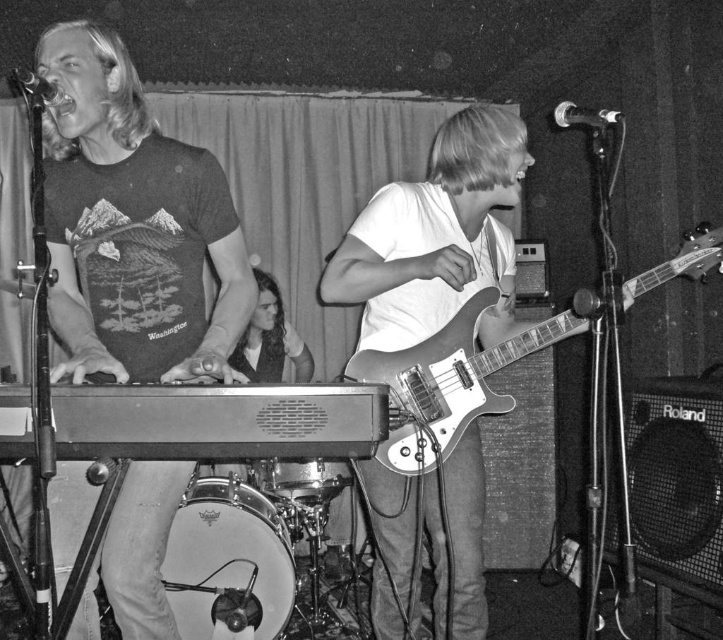
You are a photographer at the back of the venue and want to capture a clear shot of both the dark brown leather jacket at center and the metallic drum at center. Which object should you zoom in on to ensure both are in focus without moving your position?

The dark brown leather jacket at center is larger in size than the metallic drum at center, so you should zoom in on the metallic drum at center to ensure both are in focus without moving your position.

You are a photographer trying to capture a candid shot of the musician in the dark brown leather jacket at center and the metallic drum at center. Since you want to ensure both are in frame, can you determine which object is closer to the left side of the stage?

The dark brown leather jacket at center is positioned on the left side of metallic drum at center, so it is closer to the left side of the stage.

You are a photographer positioned at the front of the stage. You want to capture a closeup shot of the matte black keyboard at left without moving your position. Can you do this with a standard camera lens that has a minimum focusing distance of 1.5 meters?

The matte black keyboard at left is 1.62 meters from viewer. Since the minimum focusing distance of the camera lens is 1.5 meters, the photographer cannot get close enough to capture the closeup shot without moving closer.